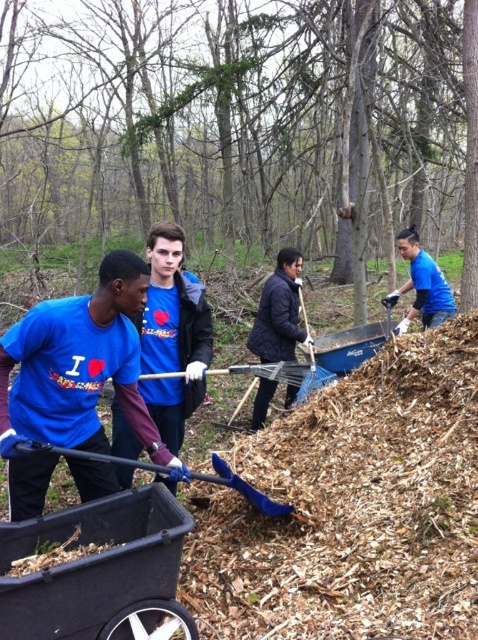
Question: Which point is farther to the camera?

Choices:
 (A) blue matte shirt at upper right
 (B) dark blue quilted jacket at center
 (C) blue matte shirt at center

Answer: (A)

Question: Among these objects, which one is farthest from the camera?

Choices:
 (A) blue plastic shovel at lower center
 (B) blue matte shirt at center
 (C) black plastic cart at lower left

Answer: (A)

Question: Is black plastic cart at lower left positioned in front of blue matte shirt at upper right?

Choices:
 (A) yes
 (B) no

Answer: (A)

Question: Is black plastic cart at lower left to the left of blue plastic shovel at lower center from the viewer's perspective?

Choices:
 (A) yes
 (B) no

Answer: (A)

Question: Which of these objects is positioned farthest from the blue matte shirt at upper right?

Choices:
 (A) blue plastic shovel at lower center
 (B) dark blue quilted jacket at center

Answer: (A)

Question: Is blue matte shirt at upper right positioned at the back of blue plastic shovel at lower center?

Choices:
 (A) no
 (B) yes

Answer: (B)